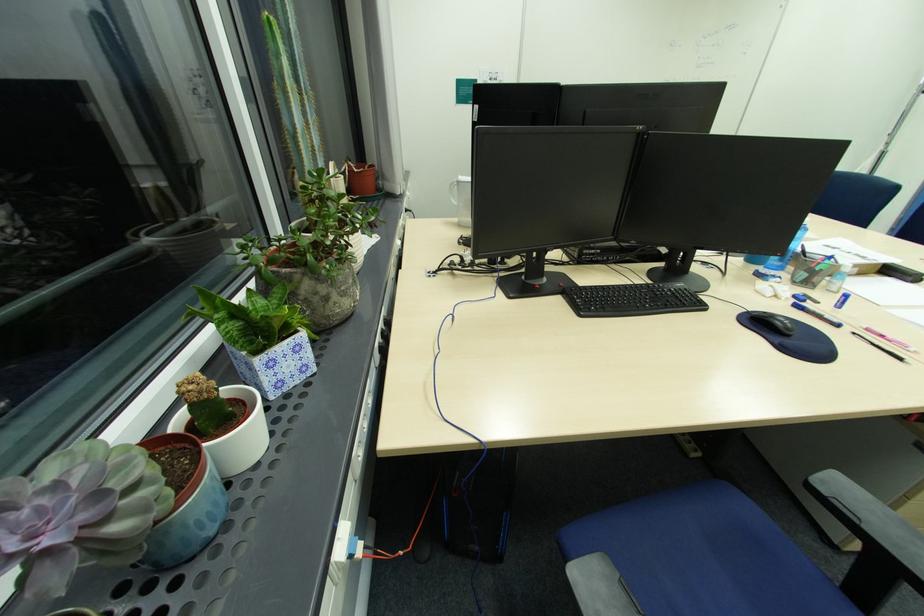
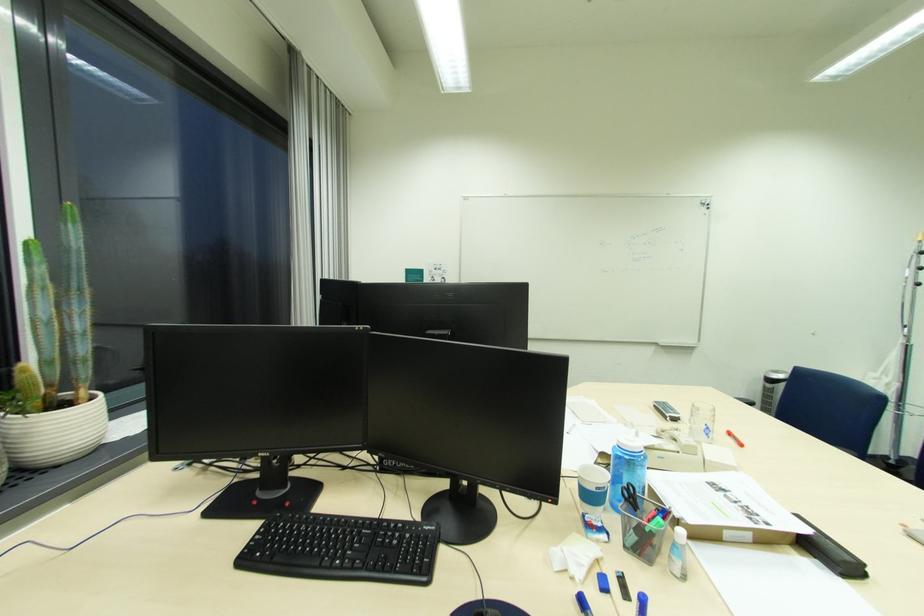
Find the pixel in the second image that matches pixel 771 269 in the first image.

(616, 511)